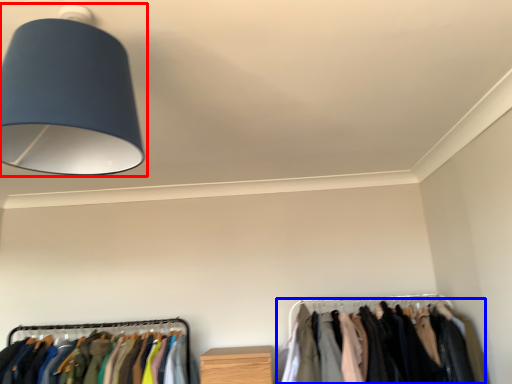
Question: Among these objects, which one is nearest to the camera, lamp (highlighted by a red box) or closet (highlighted by a blue box)?

Choices:
 (A) lamp
 (B) closet

Answer: (A)